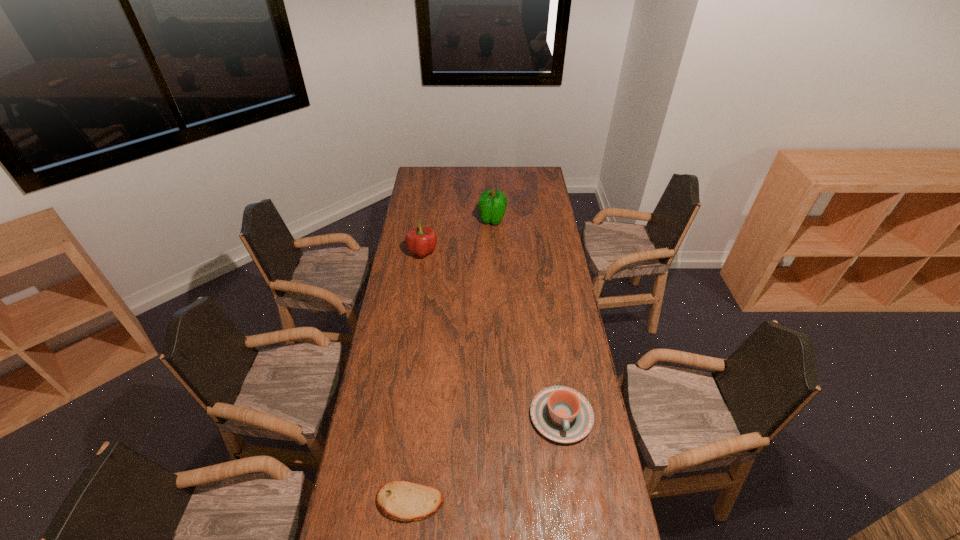
At what (x,y) coordinates should I click in order to perform the action: click on object that is the third closest to the second farthest object. Please return your answer as a coordinate pair (x, y). The image size is (960, 540). Looking at the image, I should click on (405, 501).

At what (x,y) coordinates should I click in order to perform the action: click on free space that satisfies the following two spatial constraints: 1. on the back side of the right bell pepper; 2. on the right side of the pita bread. Please return your answer as a coordinate pair (x, y). Looking at the image, I should click on (441, 220).